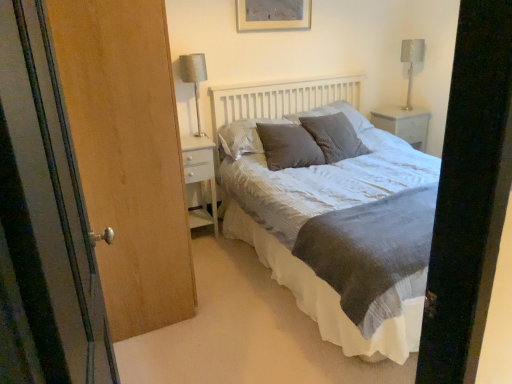
Locate an element on the screen. vacant area that is situated to the right of white wood nightstand at left, placed as the 1th nightstand when sorted from front to back is located at coordinates (228, 241).